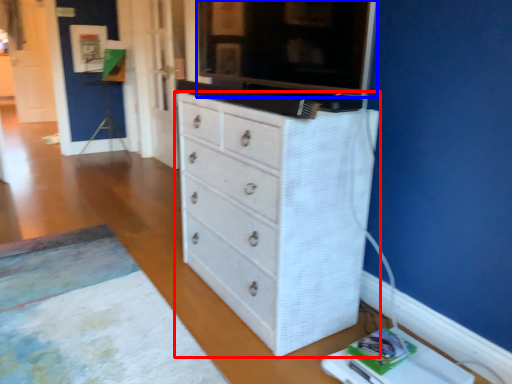
Question: Which object is closer to the camera taking this photo, chest of drawers (highlighted by a red box) or tv cabinet (highlighted by a blue box)?

Choices:
 (A) chest of drawers
 (B) tv cabinet

Answer: (B)